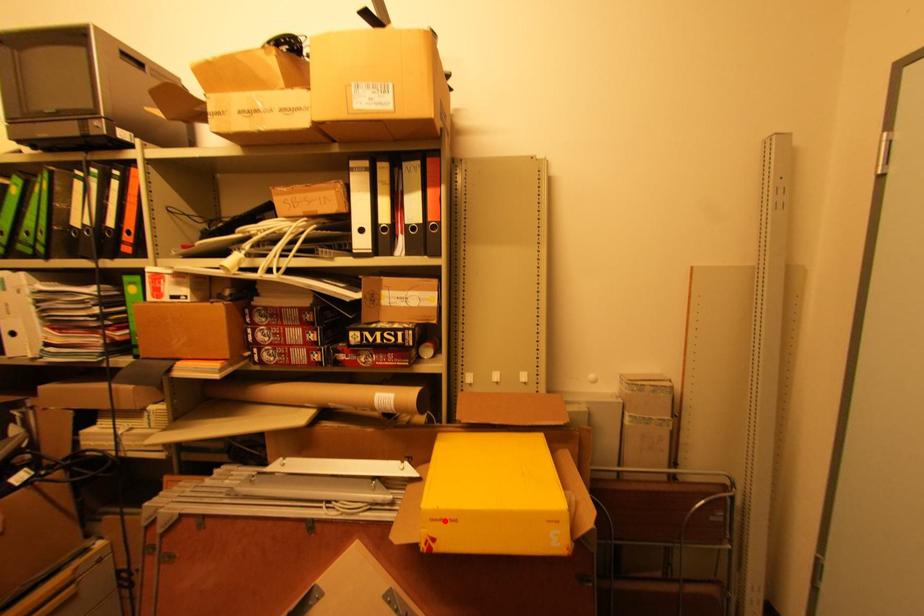
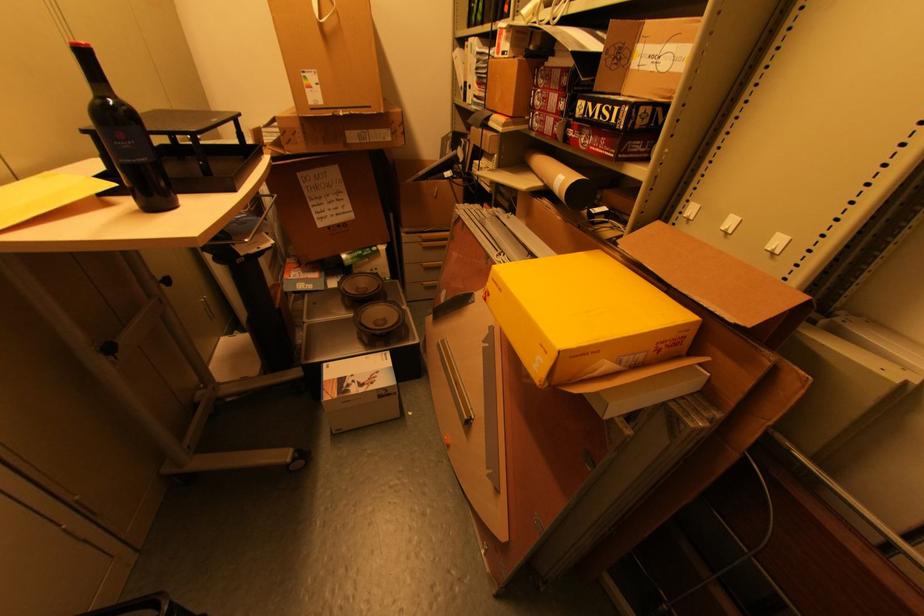
Locate, in the second image, the point that corresponds to the highlighted location in the first image.

(499, 284)